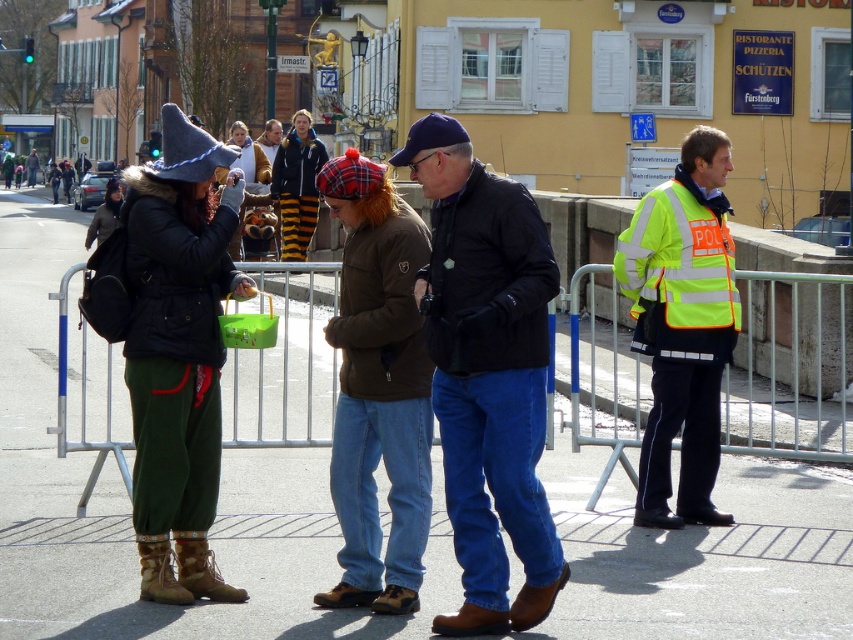
Question: Estimate the real-world distances between objects in this image. Which object is farther from the brown leather jacket at center?

Choices:
 (A) dark blue denim jeans at center
 (B) high-visibility yellow safety vest at right
 (C) high-visibility reflective vest at right

Answer: (B)

Question: Which point is closer to the camera?

Choices:
 (A) (392, 577)
 (B) (144, 378)

Answer: (A)

Question: Based on their relative distances, which object is farther from the high-visibility reflective vest at right?

Choices:
 (A) high-visibility yellow safety vest at right
 (B) dark blue denim jeans at center
 (C) brown leather jacket at center

Answer: (B)

Question: Is matte black jacket at left smaller than high-visibility reflective vest at right?

Choices:
 (A) yes
 (B) no

Answer: (A)

Question: Is dark blue denim jeans at center closer to the viewer compared to matte black jacket at left?

Choices:
 (A) no
 (B) yes

Answer: (B)

Question: Is dark blue denim jeans at center below matte black jacket at left?

Choices:
 (A) no
 (B) yes

Answer: (B)